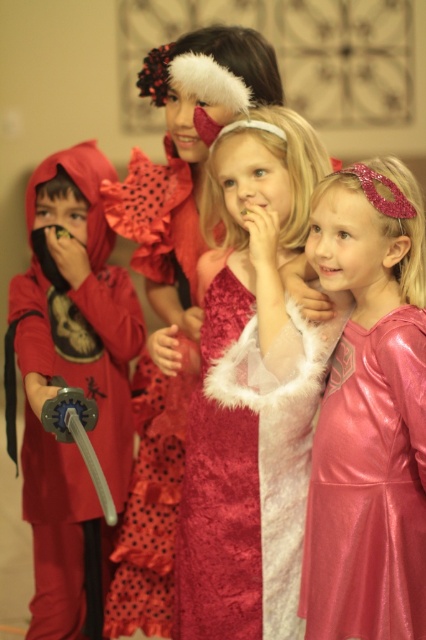
Does matte red costume at left appear on the right side of fuzzy pink dress at center?

Incorrect, matte red costume at left is not on the right side of fuzzy pink dress at center.

Consider the image. Who is taller, matte red costume at left or fuzzy pink dress at center?

matte red costume at left is taller.

Describe the element at coordinates (72, 387) in the screenshot. The height and width of the screenshot is (640, 426). I see `matte red costume at left` at that location.

At what (x,y) coordinates should I click in order to perform the action: click on matte red costume at left. Please return your answer as a coordinate pair (x, y). This screenshot has height=640, width=426. Looking at the image, I should click on (72, 387).

Consider the image. Does shiny pink dress at center appear on the right side of fuzzy pink dress at center?

Indeed, shiny pink dress at center is positioned on the right side of fuzzy pink dress at center.

Is shiny pink dress at center below fuzzy pink dress at center?

No, shiny pink dress at center is not below fuzzy pink dress at center.

Describe the element at coordinates (370, 416) in the screenshot. I see `shiny pink dress at center` at that location.

Where is `shiny pink dress at center`? shiny pink dress at center is located at coordinates pos(370,416).

In the scene shown: Between shiny pink dress at center and matte red costume at left, which one appears on the right side from the viewer's perspective?

shiny pink dress at center

Does point (396, 577) come behind point (81, 476)?

No, (396, 577) is in front of (81, 476).

What are the coordinates of `shiny pink dress at center` in the screenshot? It's located at pyautogui.click(x=370, y=416).